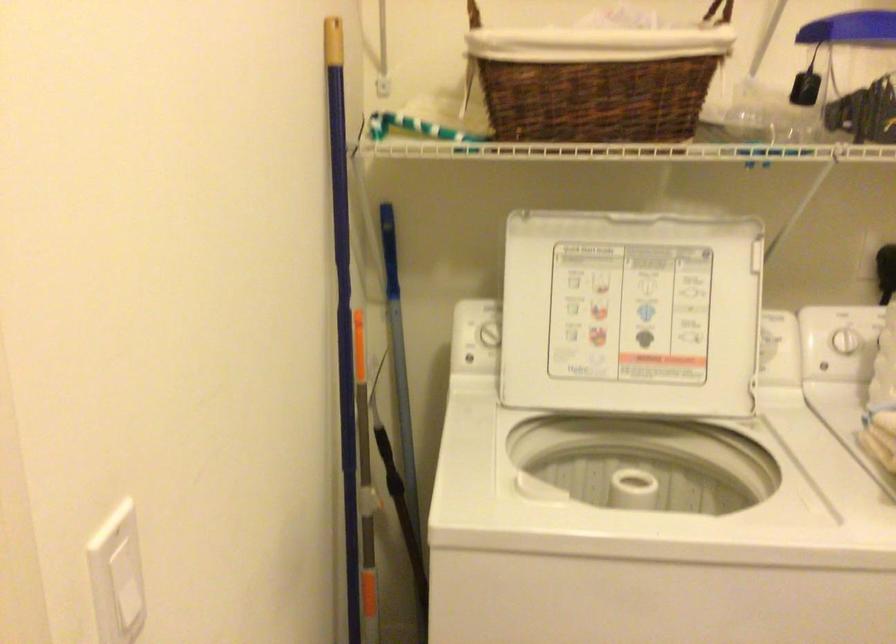
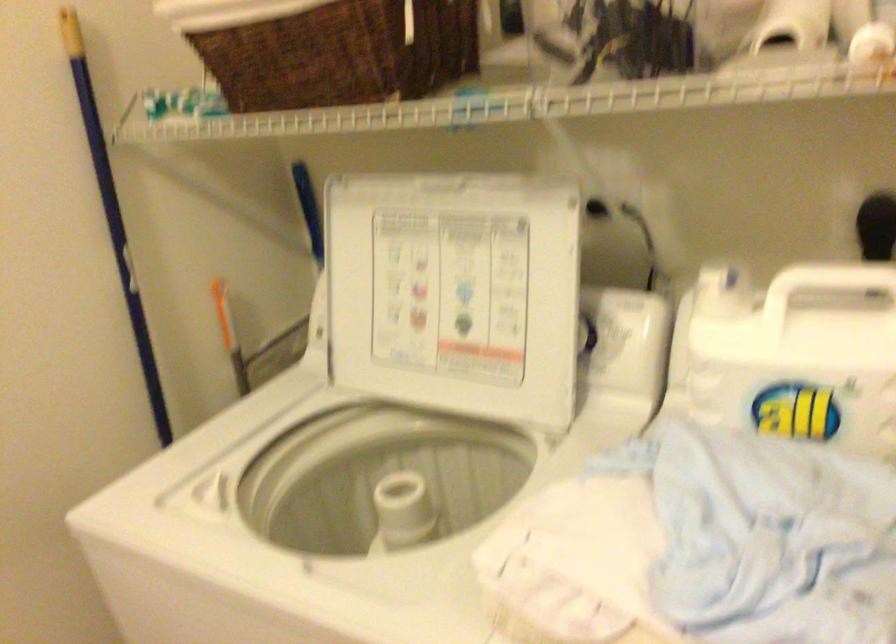
Find the pixel in the second image that matches point 636,310 in the first image.

(454, 292)